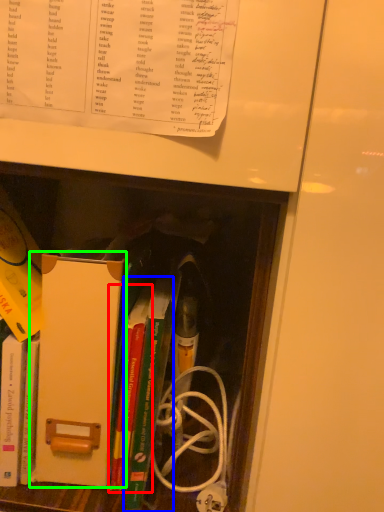
Question: Based on their relative distances, which object is nearer to book (highlighted by a red box)? Choose from book (highlighted by a blue box) and paperback book (highlighted by a green box).

Choices:
 (A) book
 (B) paperback book

Answer: (A)